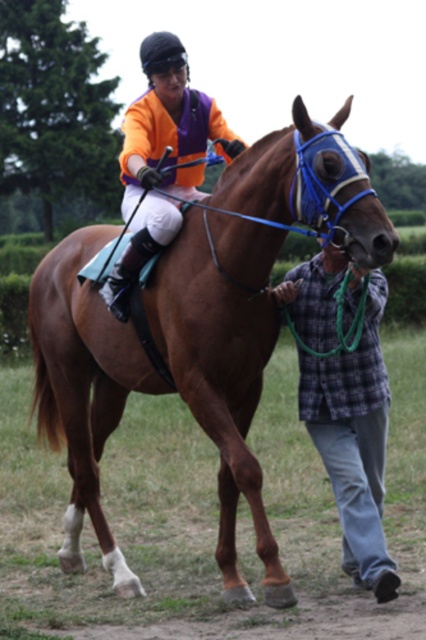
Can you confirm if plaid flannel shirt at lower right is thinner than orange jersey at center?

Correct, plaid flannel shirt at lower right's width is less than orange jersey at center's.

Is plaid flannel shirt at lower right closer to the viewer compared to orange jersey at center?

Yes, it is in front of orange jersey at center.

The image size is (426, 640). Identify the location of plaid flannel shirt at lower right. (354, 442).

Where is `plaid flannel shirt at lower right`? The height and width of the screenshot is (640, 426). plaid flannel shirt at lower right is located at coordinates (354, 442).

This screenshot has height=640, width=426. Describe the element at coordinates (250, 307) in the screenshot. I see `brown glossy horse at center` at that location.

Is brown glossy horse at center further to camera compared to plaid flannel shirt at lower right?

No.

This screenshot has height=640, width=426. Describe the element at coordinates (250, 307) in the screenshot. I see `brown glossy horse at center` at that location.

You are a GUI agent. You are given a task and a screenshot of the screen. Output one action in this format:
    pyautogui.click(x=<x>, y=<y>)
    Task: Click on the brown glossy horse at center
    Image resolution: width=426 pixels, height=640 pixels.
    Given the screenshot: What is the action you would take?
    pyautogui.click(x=250, y=307)

Is point (39, 339) positioned in front of point (149, 86)?

No, (39, 339) is behind (149, 86).

Is the position of brown glossy horse at center more distant than that of orange jersey at center?

No, brown glossy horse at center is in front of orange jersey at center.

Does point (37, 352) come farther from viewer compared to point (143, 68)?

No, (37, 352) is in front of (143, 68).

Where is `brown glossy horse at center`? brown glossy horse at center is located at coordinates (250, 307).